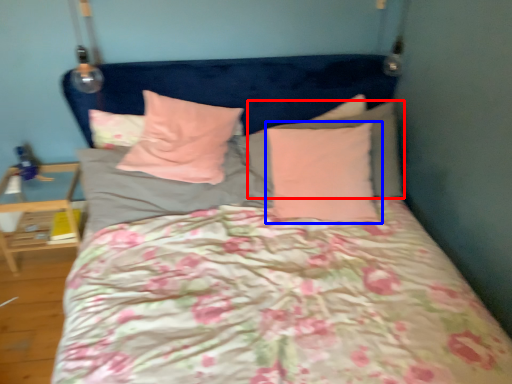
Question: Among these objects, which one is farthest to the camera, pillow (highlighted by a red box) or pillow (highlighted by a blue box)?

Choices:
 (A) pillow
 (B) pillow

Answer: (A)